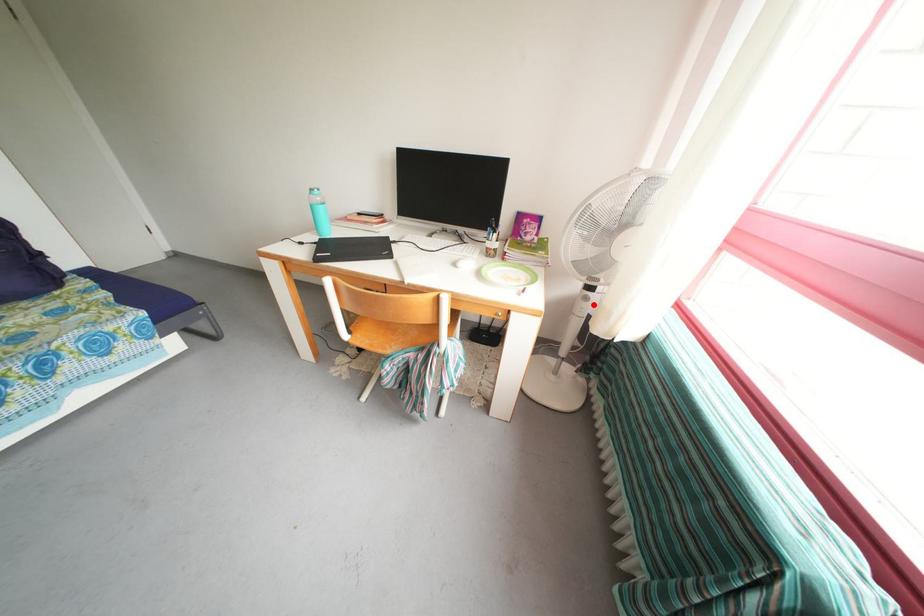
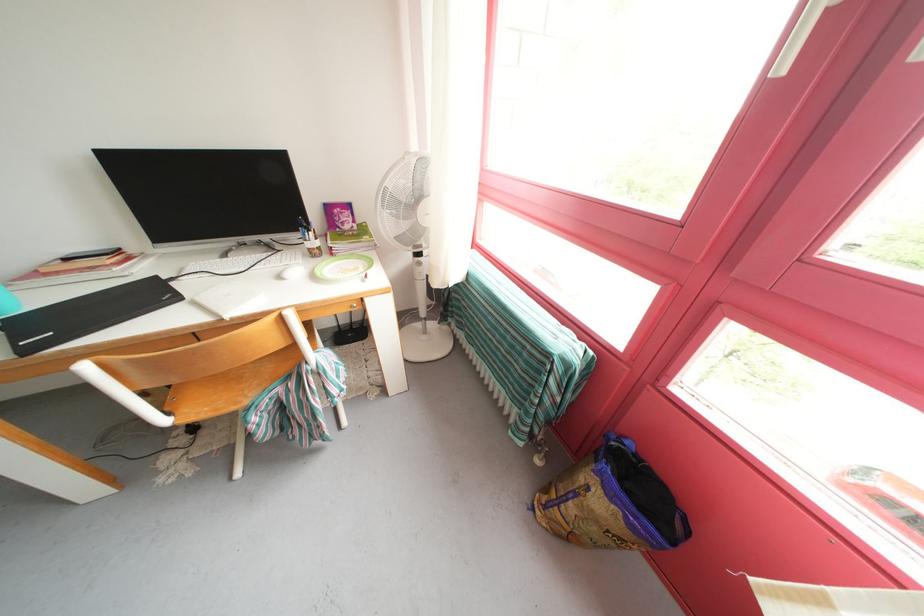
Find the pixel in the second image that matches the highlighted location in the first image.

(427, 270)